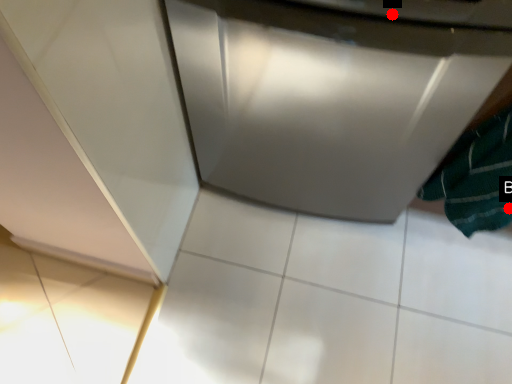
Question: Two points are circled on the image, labeled by A and B beside each circle. Which point appears farthest from the camera in this image?

Choices:
 (A) A is further
 (B) B is further

Answer: (B)